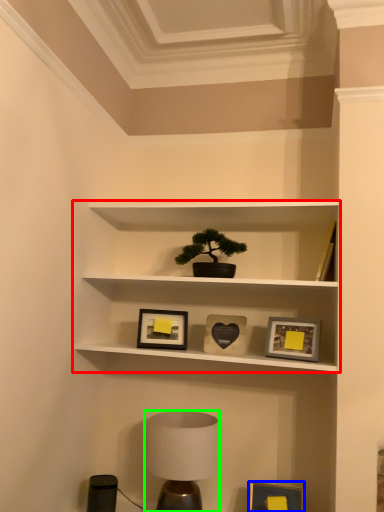
Question: Estimate the real-world distances between objects in this image. Which object is farther from shelf (highlighted by a red box), picture frame (highlighted by a blue box) or table lamp (highlighted by a green box)?

Choices:
 (A) picture frame
 (B) table lamp

Answer: (A)